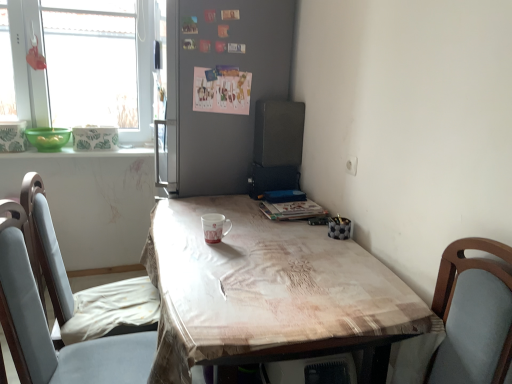
Where is `free space in front of white glossy mug at center`? free space in front of white glossy mug at center is located at coordinates (212, 260).